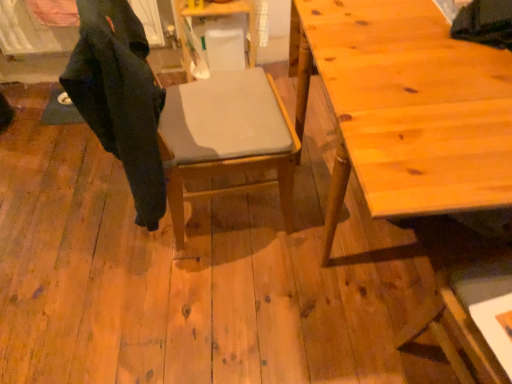
Where is `free space that is to the left of matte gray cushion at center`? This screenshot has height=384, width=512. free space that is to the left of matte gray cushion at center is located at coordinates (95, 227).